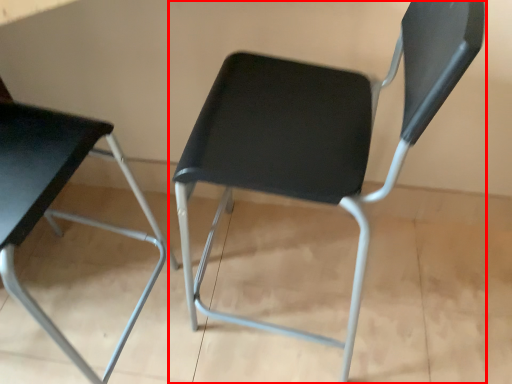
Question: Where is chair (annotated by the red box) located in relation to chair in the image?

Choices:
 (A) left
 (B) right

Answer: (B)